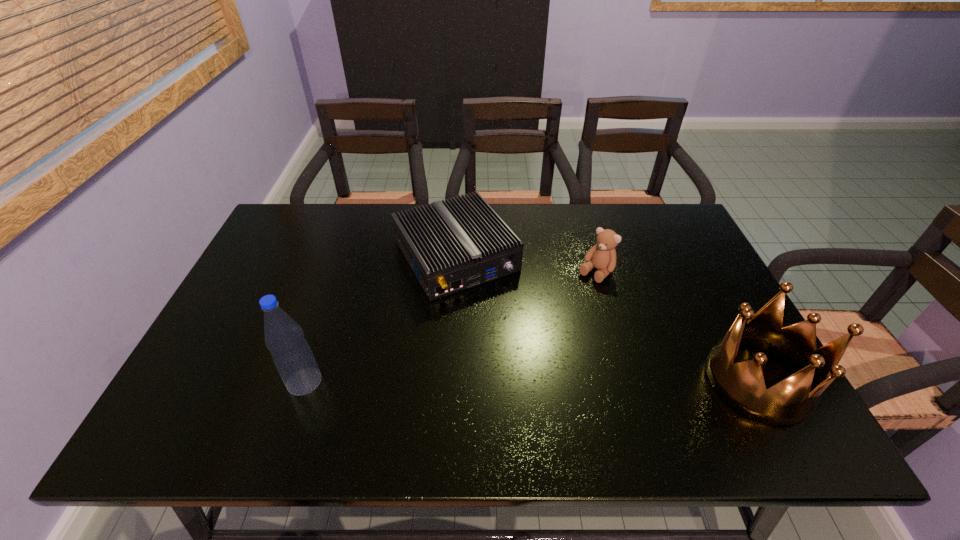
Locate an element on the screen. vacant space on the desktop that is between the water bottle and the rightmost object and is positioned on the face of the second shortest object is located at coordinates (492, 381).

Find the location of a particular element. vacant space on the desktop that is between the tallest object and the third shortest object and is positioned on the back panel of the router is located at coordinates click(x=543, y=381).